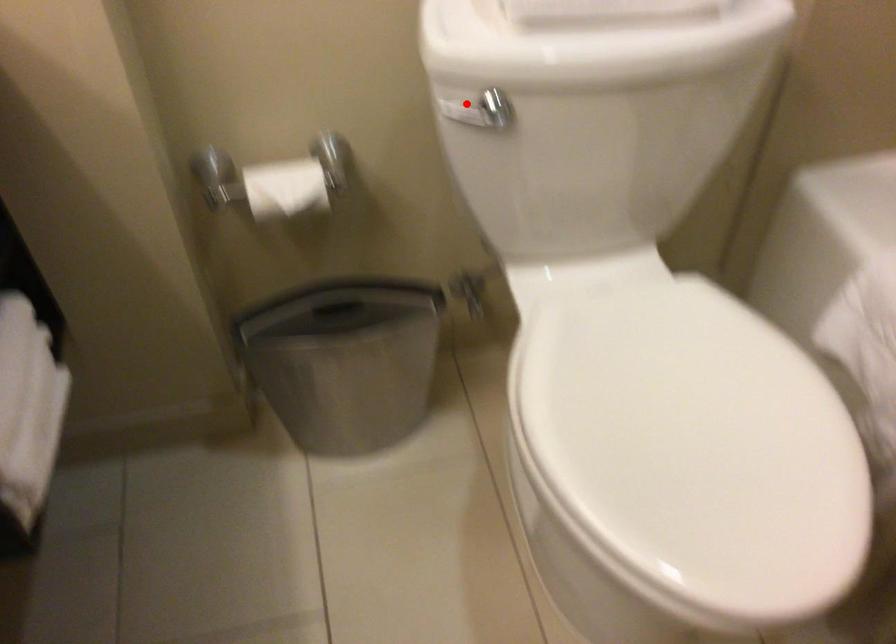
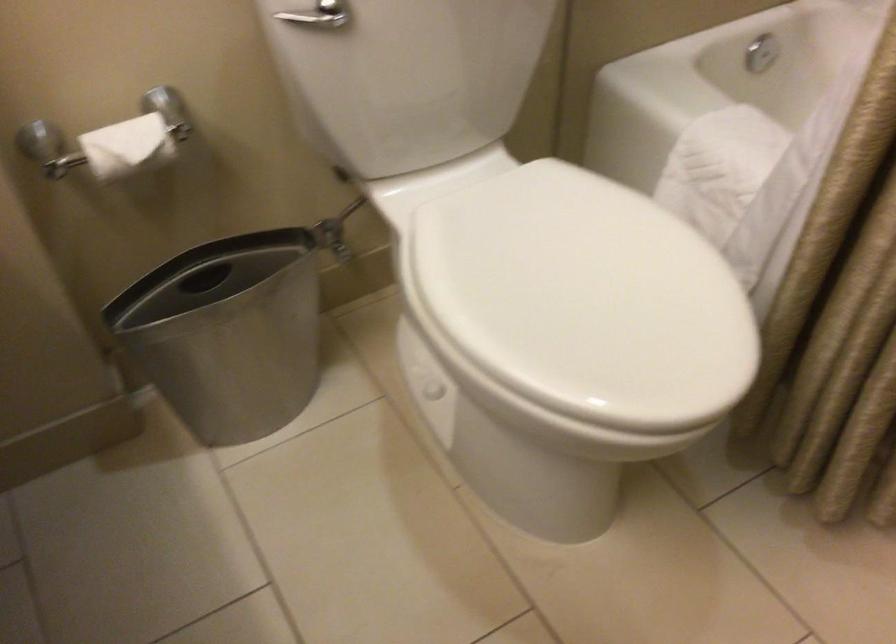
Locate, in the second image, the point that corresponds to the highlighted location in the first image.

(305, 17)